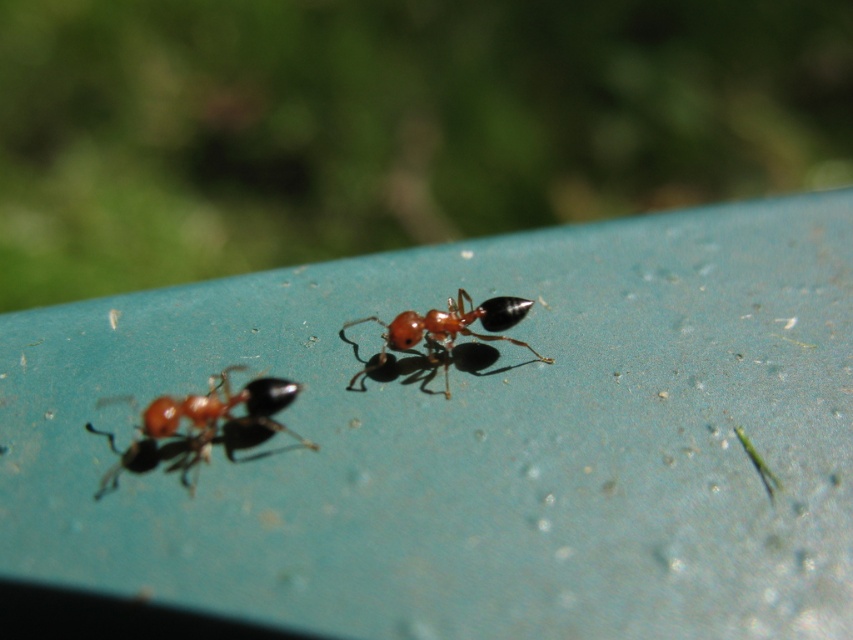
You are observing two ants on a teal surface. The first ant is at point (242,401) and the second is at point (444,339). If you want to reach the second ant first, which direction should you move from the first ant?

To reach the second ant at point (444,339) first, you should move backward from the first ant at point (242,401) since it is positioned behind the first ant.

You are observing two ants on a teal surface. The shiny orange ant at lower left and the shiny red ant at center are both moving. Which ant is positioned further to the left?

The shiny orange ant at lower left is positioned further to the left compared to the shiny red ant at center.

You are a photographer trying to capture a closeup of both the shiny orange ant at lower left and the shiny red ant at center. Which ant should you focus on first to ensure both are in focus?

You should focus on the shiny red ant at center first because it is farther away from the viewer than the shiny orange ant at lower left, allowing the camera to adjust focus for both.